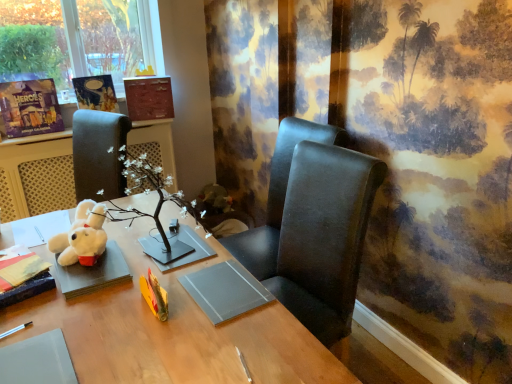
Question: From the image's perspective, is matte brown book at upper center, the first book viewed from the back, on top of white plush toy at left?

Choices:
 (A) yes
 (B) no

Answer: (A)

Question: Is matte brown book at upper center, the 4th book from the bottom, wider than white plush toy at left?

Choices:
 (A) yes
 (B) no

Answer: (B)

Question: Considering the relative positions of matte brown book at upper center, the 4th book from the bottom, and white plush toy at left in the image provided, is matte brown book at upper center, the 4th book from the bottom, in front of white plush toy at left?

Choices:
 (A) no
 (B) yes

Answer: (A)

Question: Is matte brown book at upper center, the first book viewed from the back, in contact with white plush toy at left?

Choices:
 (A) yes
 (B) no

Answer: (B)

Question: Considering the relative sizes of matte brown book at upper center, acting as the first book starting from the top, and white plush toy at left in the image provided, is matte brown book at upper center, acting as the first book starting from the top, bigger than white plush toy at left?

Choices:
 (A) yes
 (B) no

Answer: (B)

Question: From a real-world perspective, is white plush toy at lower left physically located above or below matte cardboard book at upper left, marked as the second book in a front-to-back arrangement?

Choices:
 (A) above
 (B) below

Answer: (B)

Question: Is white plush toy at lower left inside or outside of matte cardboard book at upper left, which appears as the 2th book when ordered from the bottom?

Choices:
 (A) outside
 (B) inside

Answer: (A)

Question: Considering the positions of point (75, 236) and point (8, 109), is point (75, 236) closer or farther from the camera than point (8, 109)?

Choices:
 (A) farther
 (B) closer

Answer: (B)

Question: In the image, is white plush toy at lower left on the left side or the right side of matte cardboard book at upper left, which appears as the 2th book when ordered from the bottom?

Choices:
 (A) left
 (B) right

Answer: (B)

Question: From a real-world perspective, is wooden desk at center physically located above or below matte black book at lower left, which is the 1th book from bottom to top?

Choices:
 (A) above
 (B) below

Answer: (B)

Question: Considering their positions, is wooden desk at center located in front of or behind matte black book at lower left, acting as the 4th book starting from the back?

Choices:
 (A) front
 (B) behind

Answer: (A)

Question: Considering the positions of point (119, 324) and point (3, 304), is point (119, 324) closer or farther from the camera than point (3, 304)?

Choices:
 (A) farther
 (B) closer

Answer: (B)

Question: From the image's perspective, is wooden desk at center located above or below matte black book at lower left, arranged as the 1th book when viewed from the front?

Choices:
 (A) below
 (B) above

Answer: (A)

Question: From the image's perspective, relative to matte paper book at upper left, which is counted as the 3th book, starting from the bottom, is black leather chair at center, acting as the second chair starting from the top, above or below?

Choices:
 (A) below
 (B) above

Answer: (A)

Question: Considering the relative positions of black leather chair at center, which is counted as the 1th chair, starting from the bottom, and matte paper book at upper left, which is counted as the 3th book, starting from the bottom, in the image provided, is black leather chair at center, which is counted as the 1th chair, starting from the bottom, to the left or to the right of matte paper book at upper left, which is counted as the 3th book, starting from the bottom,?

Choices:
 (A) right
 (B) left

Answer: (A)